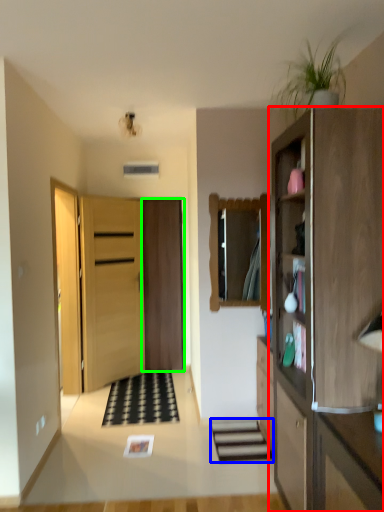
Question: Estimate the real-world distances between objects in this image. Which object is farther from cabinetry (highlighted by a red box), stairwell (highlighted by a blue box) or door (highlighted by a green box)?

Choices:
 (A) stairwell
 (B) door

Answer: (B)